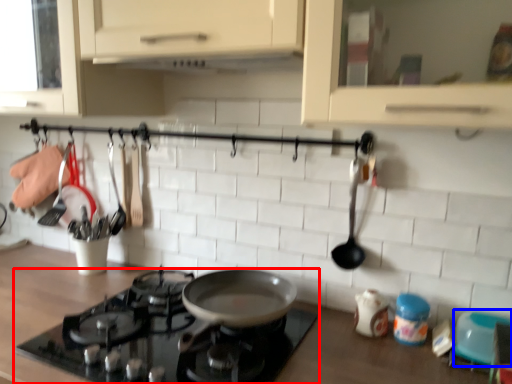
Question: Which object appears farthest to the camera in this image, gas stove (highlighted by a red box) or appliance (highlighted by a blue box)?

Choices:
 (A) gas stove
 (B) appliance

Answer: (B)